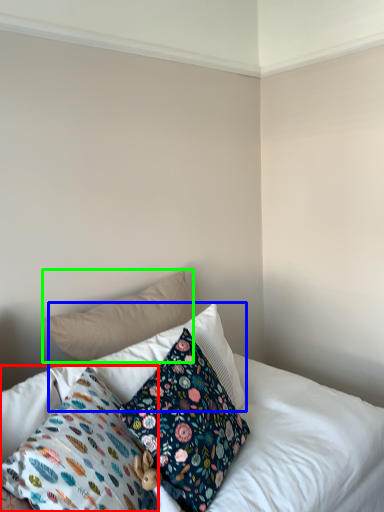
Question: Which object is the farthest from pillow (highlighted by a red box)? Choose among these: pillow (highlighted by a blue box) or pillow (highlighted by a green box).

Choices:
 (A) pillow
 (B) pillow

Answer: (B)